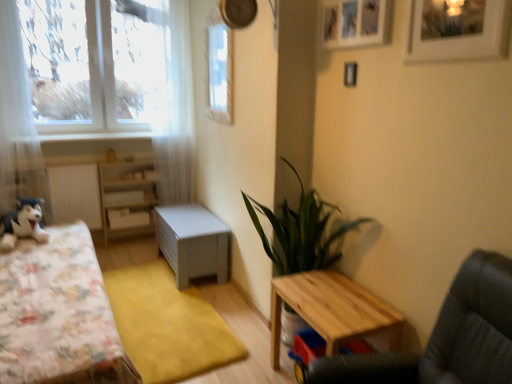
Question: Does fluffy fabric bed at left appear on the right side of wooden swivel chair at lower right?

Choices:
 (A) no
 (B) yes

Answer: (A)

Question: Considering the relative sizes of fluffy fabric bed at left and wooden swivel chair at lower right in the image provided, is fluffy fabric bed at left shorter than wooden swivel chair at lower right?

Choices:
 (A) yes
 (B) no

Answer: (B)

Question: Is fluffy fabric bed at left positioned before wooden swivel chair at lower right?

Choices:
 (A) yes
 (B) no

Answer: (B)

Question: From the image's perspective, is fluffy fabric bed at left on wooden swivel chair at lower right?

Choices:
 (A) no
 (B) yes

Answer: (B)

Question: From the image's perspective, is fluffy fabric bed at left located beneath wooden swivel chair at lower right?

Choices:
 (A) no
 (B) yes

Answer: (A)

Question: Looking at their shapes, would you say wooden swivel chair at lower right is wider or thinner than clear plastic window screen at upper center?

Choices:
 (A) wide
 (B) thin

Answer: (A)

Question: From a real-world perspective, is wooden swivel chair at lower right physically located above or below clear plastic window screen at upper center?

Choices:
 (A) below
 (B) above

Answer: (A)

Question: Considering their positions, is wooden swivel chair at lower right located in front of or behind clear plastic window screen at upper center?

Choices:
 (A) behind
 (B) front

Answer: (B)

Question: Is point (442, 380) positioned closer to the camera than point (226, 57)?

Choices:
 (A) closer
 (B) farther

Answer: (A)

Question: Is green leafy plant at center wider or thinner than black plush toy at left?

Choices:
 (A) thin
 (B) wide

Answer: (B)

Question: Which is correct: green leafy plant at center is inside black plush toy at left, or outside of it?

Choices:
 (A) inside
 (B) outside

Answer: (B)

Question: Is green leafy plant at center in front of or behind black plush toy at left in the image?

Choices:
 (A) behind
 (B) front

Answer: (B)

Question: Is point [311, 248] closer or farther from the camera than point [19, 223]?

Choices:
 (A) farther
 (B) closer

Answer: (B)

Question: Considering the positions of white sheer curtain at left, the 2th curtain when ordered from back to front, and black plush toy at left in the image, is white sheer curtain at left, the 2th curtain when ordered from back to front, bigger or smaller than black plush toy at left?

Choices:
 (A) small
 (B) big

Answer: (A)

Question: Do you think white sheer curtain at left, positioned as the 1th curtain in left-to-right order, is within black plush toy at left, or outside of it?

Choices:
 (A) inside
 (B) outside

Answer: (B)